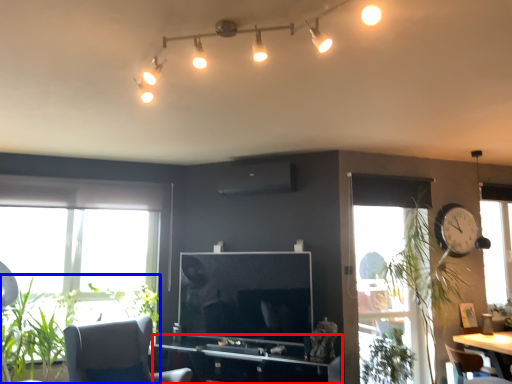
Question: Which object appears closest to the camera in this image, computer desk (highlighted by a red box) or plant (highlighted by a blue box)?

Choices:
 (A) computer desk
 (B) plant

Answer: (B)